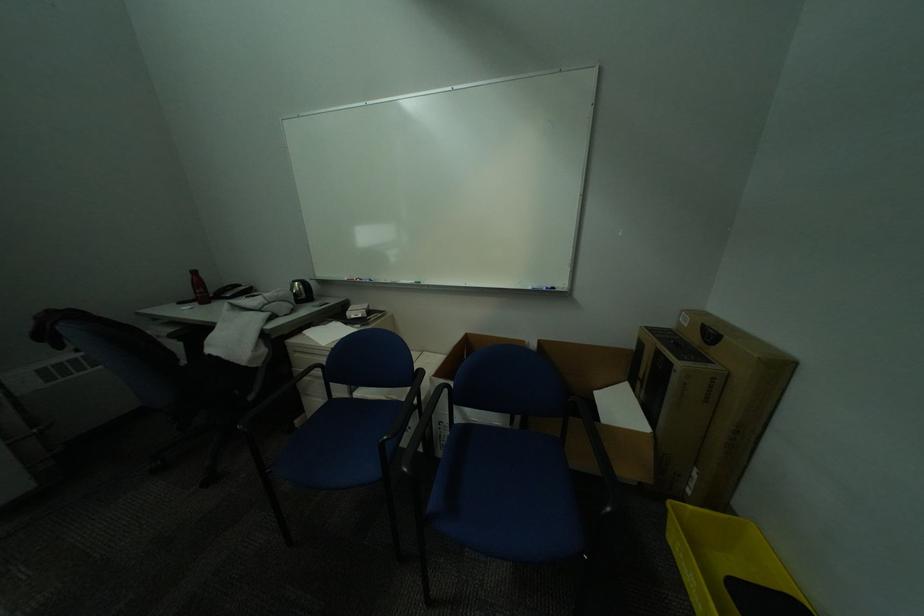
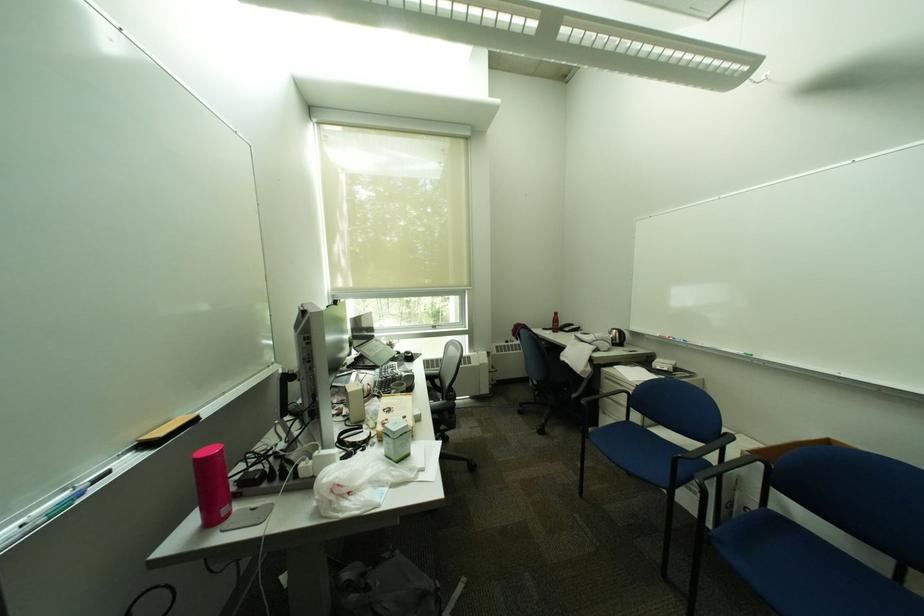
Locate, in the second image, the point that corresponds to point (285, 304) in the first image.

(611, 342)